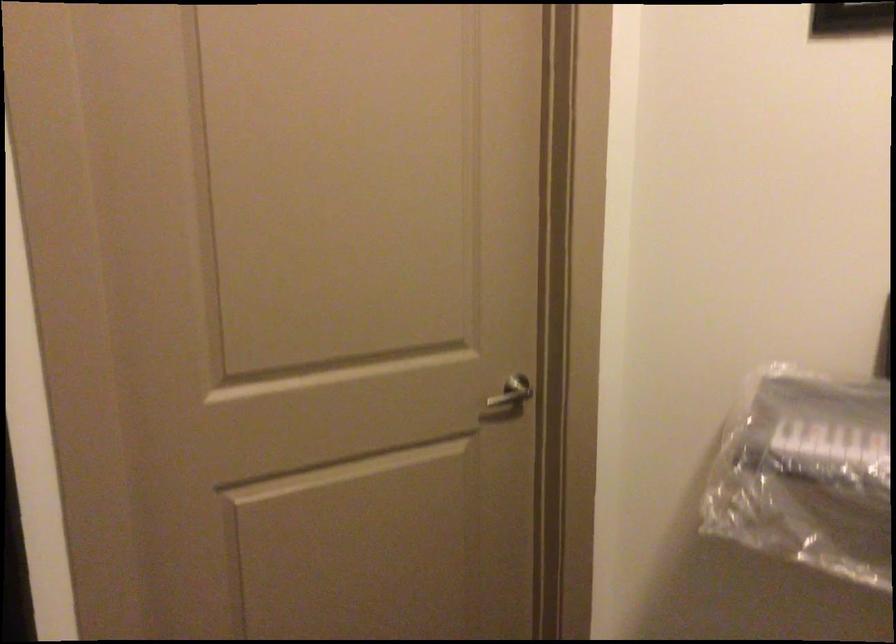
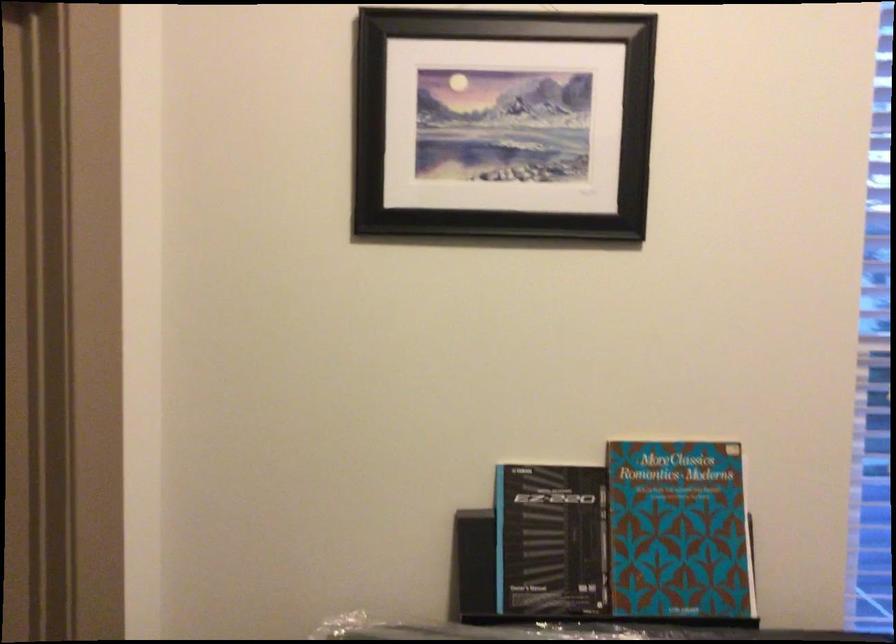
Question: The camera is either moving clockwise (left) or counter-clockwise (right) around the object. The first image is from the beginning of the video and the second image is from the end. Is the camera moving left or right when shooting the video?

Choices:
 (A) Left
 (B) Right

Answer: (A)